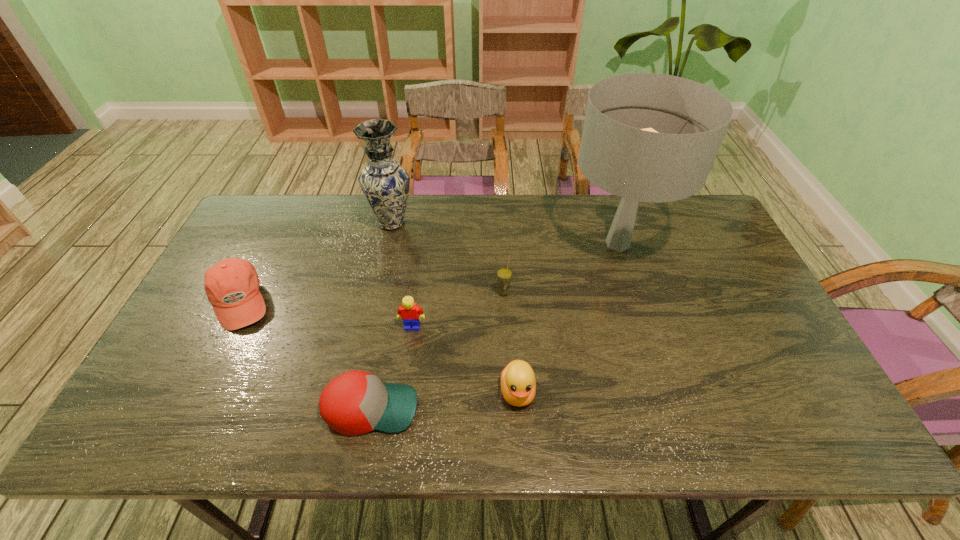
The width and height of the screenshot is (960, 540). In order to click on vacant point located between the left baseball cap and the nearer baseball cap in this screenshot , I will do `click(305, 355)`.

I want to click on free spot between the straw for drinking and the duckling, so click(x=511, y=342).

Find the location of a particular element. The width and height of the screenshot is (960, 540). free space that is in between the Lego and the leftmost object is located at coordinates (325, 314).

The image size is (960, 540). I want to click on empty space between the leftmost object and the duckling, so [378, 347].

You are a GUI agent. You are given a task and a screenshot of the screen. Output one action in this format:
    pyautogui.click(x=<x>, y=<y>)
    Task: Click on the free space between the Lego and the second tallest object
    This screenshot has height=540, width=960.
    Given the screenshot: What is the action you would take?
    pyautogui.click(x=402, y=275)

Image resolution: width=960 pixels, height=540 pixels. What are the coordinates of `blank region between the lampshade and the shortest object` in the screenshot? It's located at (494, 326).

Identify which object is the second nearest to the lampshade. Please provide its 2D coordinates. Your answer should be formatted as a tuple, i.e. [(x, y)], where the tuple contains the x and y coordinates of a point satisfying the conditions above.

[(518, 384)]

This screenshot has height=540, width=960. I want to click on object that is the closest to the straw for drinking, so click(x=648, y=137).